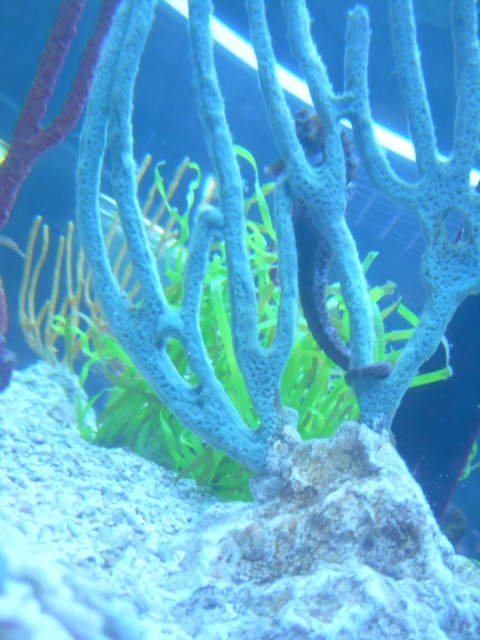
Question: Is shiny silver fish at center smaller than translucent blue fish at upper left?

Choices:
 (A) yes
 (B) no

Answer: (B)

Question: Which point appears farthest from the camera in this image?

Choices:
 (A) (458, 538)
 (B) (13, 244)

Answer: (A)

Question: Which point is closer to the camera?

Choices:
 (A) shiny silver fish at center
 (B) translucent blue fish at upper left

Answer: (A)

Question: Which of the following is the farthest from the observer?

Choices:
 (A) (0, 243)
 (B) (462, 529)

Answer: (A)

Question: Does shiny silver fish at center have a smaller size compared to translucent blue fish at upper left?

Choices:
 (A) yes
 (B) no

Answer: (B)

Question: Considering the relative positions of shiny silver fish at center and translucent blue fish at upper left in the image provided, where is shiny silver fish at center located with respect to translucent blue fish at upper left?

Choices:
 (A) below
 (B) above

Answer: (A)